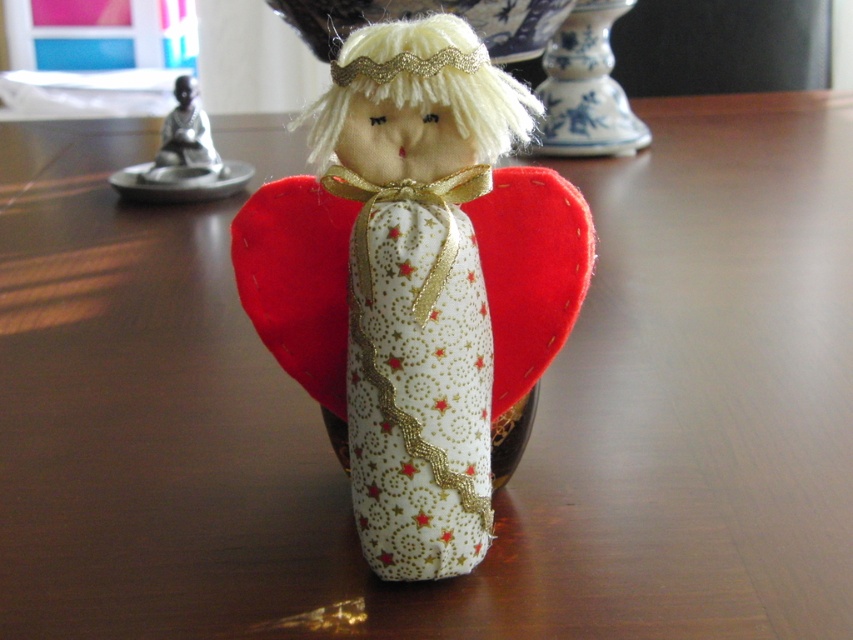
You are setting up a display for a holiday market and have the white fabric doll at center and the brushed metal statue at upper left. Which object should you place on the lower shelf if you want to follow the rule of arranging taller items lower to prevent toppling?

The white fabric doll at center is much taller than the brushed metal statue at upper left, so you should place the white fabric doll at center on the lower shelf to follow the rule of arranging taller items lower to prevent toppling.

You are an art curator examining the angel figurine. You notice two points marked in the image. Which point is closer to you, point (322,236) or point (190,134)?

Point (322,236) is closer to the viewer than point (190,134).